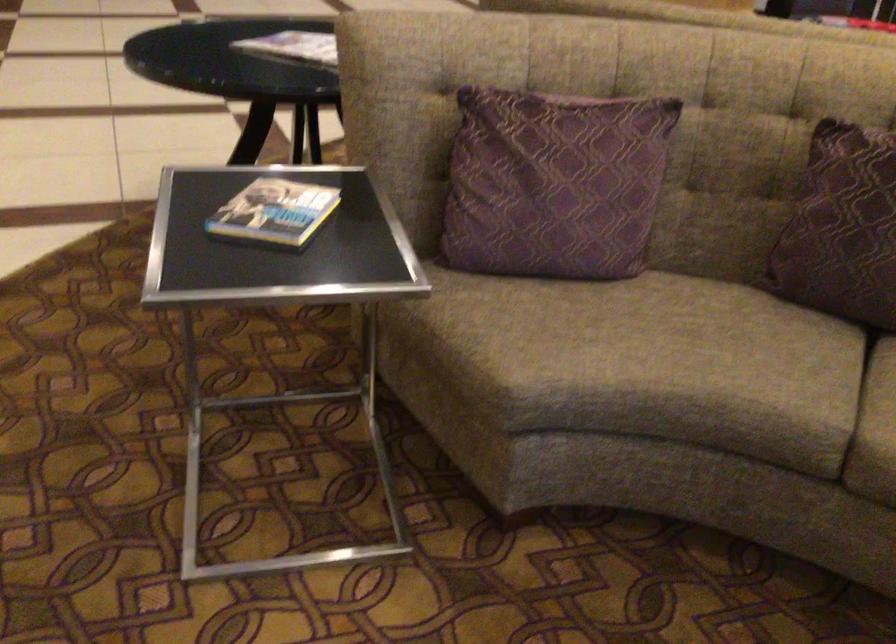
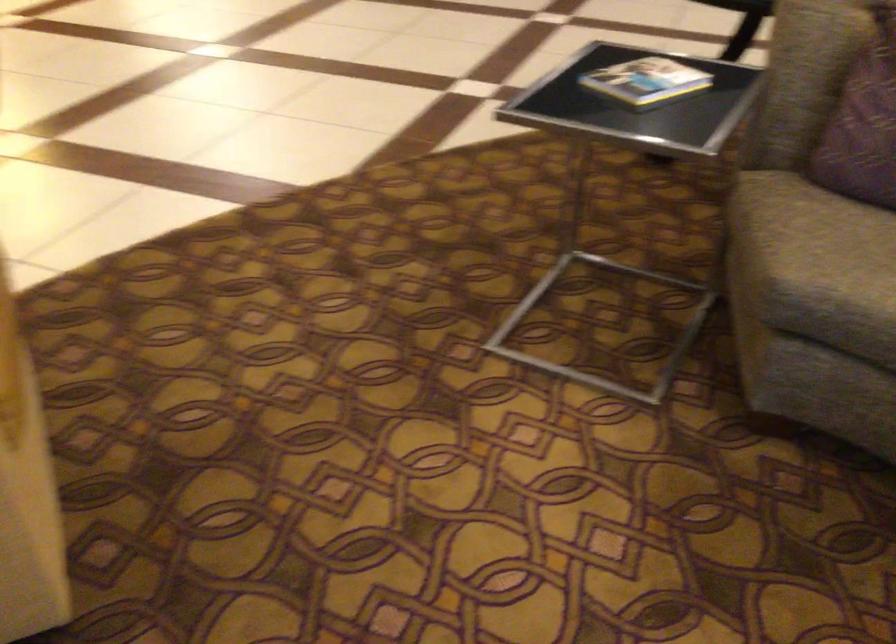
Question: Based on the continuous images, in which direction is the camera rotating? Reply with the corresponding letter.

Choices:
 (A) Left
 (B) Right
 (C) Up
 (D) Down

Answer: (A)